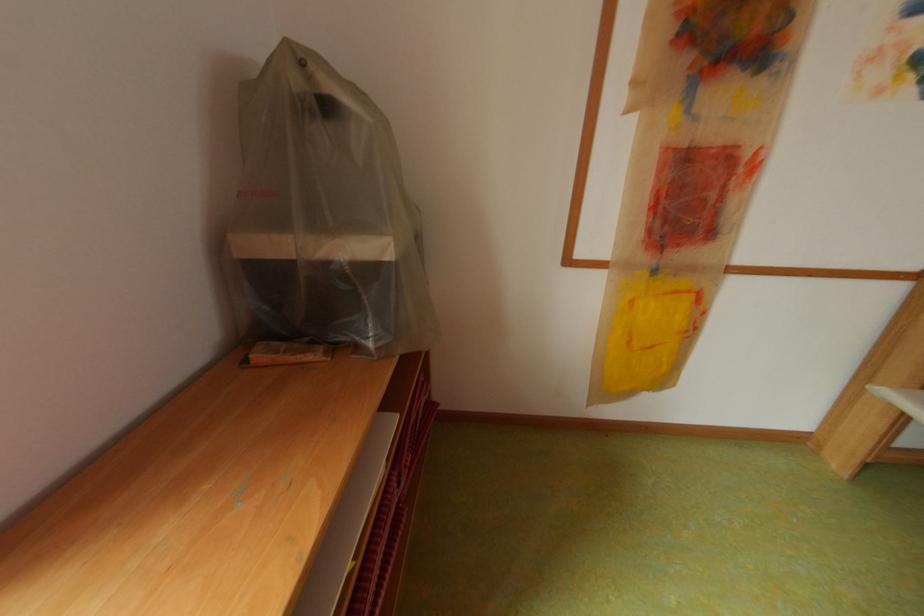
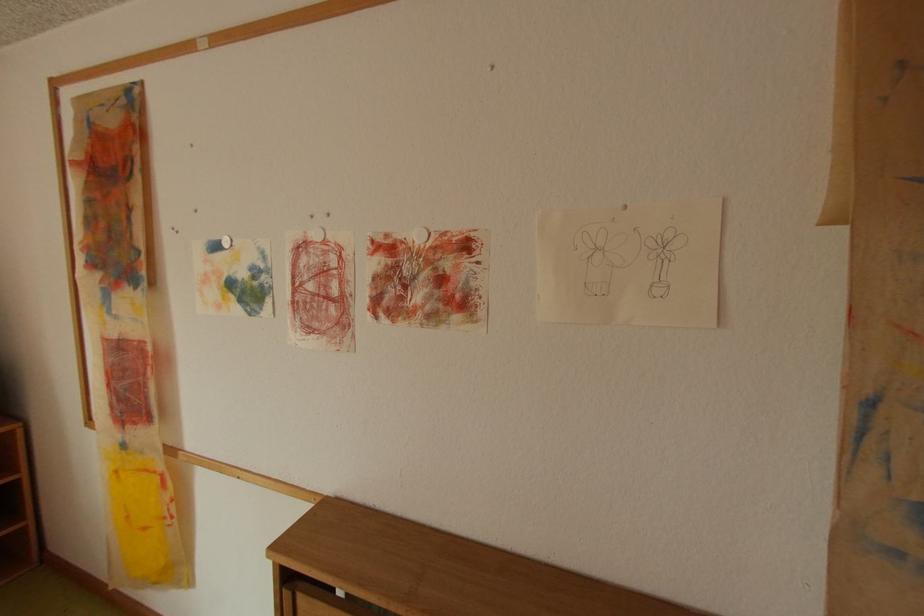
The point at (664, 272) is marked in the first image. Where is the corresponding point in the second image?

(134, 446)